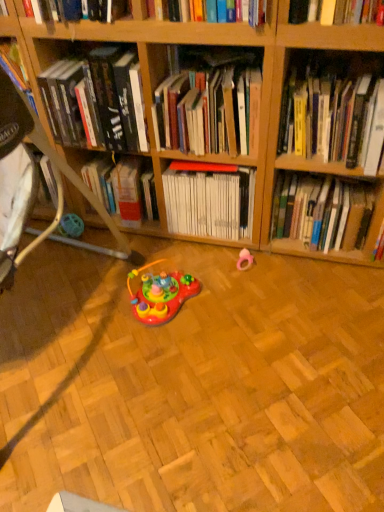
Image resolution: width=384 pixels, height=512 pixels. I want to click on vacant area that lies to the right of shiny plastic toy at center, which is the first toy in left-to-right order, so click(234, 301).